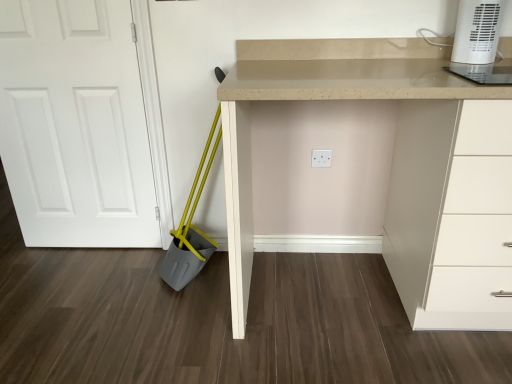
Question: Considering the relative sizes of white plastic heater at upper right and beige laminate desk at center in the image provided, is white plastic heater at upper right thinner than beige laminate desk at center?

Choices:
 (A) no
 (B) yes

Answer: (B)

Question: Is white plastic heater at upper right further to camera compared to beige laminate desk at center?

Choices:
 (A) no
 (B) yes

Answer: (B)

Question: From the image's perspective, is white plastic heater at upper right above beige laminate desk at center?

Choices:
 (A) yes
 (B) no

Answer: (A)

Question: Is white plastic heater at upper right positioned far away from beige laminate desk at center?

Choices:
 (A) yes
 (B) no

Answer: (B)

Question: Is beige laminate desk at center at the back of white plastic heater at upper right?

Choices:
 (A) yes
 (B) no

Answer: (B)

Question: Can you confirm if white plastic heater at upper right is positioned to the left of beige laminate desk at center?

Choices:
 (A) yes
 (B) no

Answer: (B)

Question: Is beige laminate desk at center oriented away from white matte door at left?

Choices:
 (A) yes
 (B) no

Answer: (B)

Question: Is beige laminate desk at center touching white matte door at left?

Choices:
 (A) yes
 (B) no

Answer: (B)

Question: Does beige laminate desk at center have a lesser width compared to white matte door at left?

Choices:
 (A) yes
 (B) no

Answer: (B)

Question: Is beige laminate desk at center to the left of white matte door at left from the viewer's perspective?

Choices:
 (A) no
 (B) yes

Answer: (A)

Question: Does beige laminate desk at center contain white matte door at left?

Choices:
 (A) yes
 (B) no

Answer: (B)

Question: Could you tell me if beige laminate desk at center is turned towards white matte door at left?

Choices:
 (A) yes
 (B) no

Answer: (B)

Question: Does beige laminate desk at center appear on the right side of white plastic heater at upper right?

Choices:
 (A) no
 (B) yes

Answer: (A)